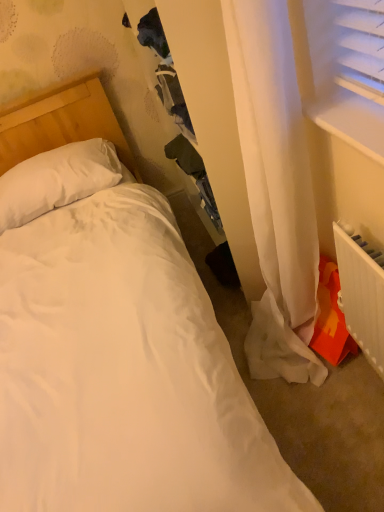
Question: Does white soft pillow at upper left have a larger size compared to white plastic window sill at upper right?

Choices:
 (A) no
 (B) yes

Answer: (B)

Question: From the image's perspective, would you say white soft pillow at upper left is positioned over white plastic window sill at upper right?

Choices:
 (A) yes
 (B) no

Answer: (A)

Question: Would you say white plastic window sill at upper right is part of white soft pillow at upper left's contents?

Choices:
 (A) no
 (B) yes

Answer: (A)

Question: Considering the relative sizes of white soft pillow at upper left and white plastic window sill at upper right in the image provided, is white soft pillow at upper left thinner than white plastic window sill at upper right?

Choices:
 (A) no
 (B) yes

Answer: (A)

Question: Considering the relative sizes of white soft pillow at upper left and white plastic window sill at upper right in the image provided, is white soft pillow at upper left smaller than white plastic window sill at upper right?

Choices:
 (A) no
 (B) yes

Answer: (A)

Question: Would you say white soft pillow at upper left is to the left or to the right of white plastic window sill at upper right in the picture?

Choices:
 (A) right
 (B) left

Answer: (B)

Question: From their relative heights in the image, would you say white soft pillow at upper left is taller or shorter than white plastic window sill at upper right?

Choices:
 (A) short
 (B) tall

Answer: (B)

Question: Considering the positions of white soft pillow at upper left and white plastic window sill at upper right in the image, is white soft pillow at upper left wider or thinner than white plastic window sill at upper right?

Choices:
 (A) wide
 (B) thin

Answer: (A)

Question: From the image's perspective, is white soft pillow at upper left above or below white plastic window sill at upper right?

Choices:
 (A) below
 (B) above

Answer: (B)

Question: Is white plastic radiator at lower right situated inside white plastic window sill at upper right or outside?

Choices:
 (A) inside
 (B) outside

Answer: (B)

Question: Visually, is white plastic radiator at lower right positioned to the left or to the right of white plastic window sill at upper right?

Choices:
 (A) right
 (B) left

Answer: (A)

Question: From their relative heights in the image, would you say white plastic radiator at lower right is taller or shorter than white plastic window sill at upper right?

Choices:
 (A) tall
 (B) short

Answer: (A)

Question: Is white plastic radiator at lower right wider or thinner than white plastic window sill at upper right?

Choices:
 (A) wide
 (B) thin

Answer: (B)

Question: Is white plastic window sill at upper right taller or shorter than white soft pillow at upper left?

Choices:
 (A) short
 (B) tall

Answer: (A)

Question: From the image's perspective, relative to white soft pillow at upper left, is white plastic window sill at upper right above or below?

Choices:
 (A) below
 (B) above

Answer: (A)